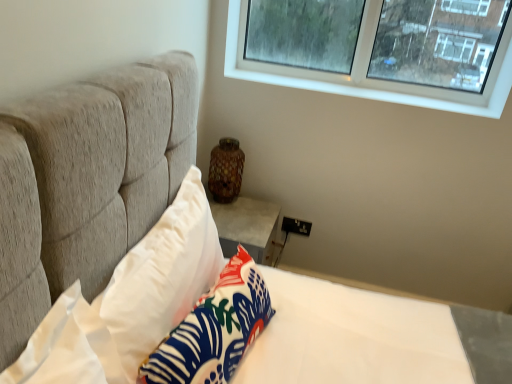
Question: In terms of width, does white smooth stone at upper right look wider or thinner when compared to white fabric pillow at lower center, the 2th pillow when ordered from left to right?

Choices:
 (A) wide
 (B) thin

Answer: (A)

Question: Relative to white fabric pillow at lower center, the 2th pillow when ordered from left to right, is white smooth stone at upper right in front or behind?

Choices:
 (A) behind
 (B) front

Answer: (A)

Question: Considering the real-world distances, which object is farthest from the white smooth stone at upper right?

Choices:
 (A) clear glass window at upper right
 (B) brown speckled ceramic vase at center
 (C) white soft pillow at upper left, positioned as the 2th pillow in right-to-left order
 (D) white fabric pillow at lower center, the first pillow from the right

Answer: (D)

Question: Estimate the real-world distances between objects in this image. Which object is farther from the white fabric pillow at lower center, the 2th pillow when ordered from left to right?

Choices:
 (A) white smooth stone at upper right
 (B) clear glass window at upper right
 (C) brown speckled ceramic vase at center
 (D) white soft pillow at upper left, the 1th pillow when ordered from left to right

Answer: (B)